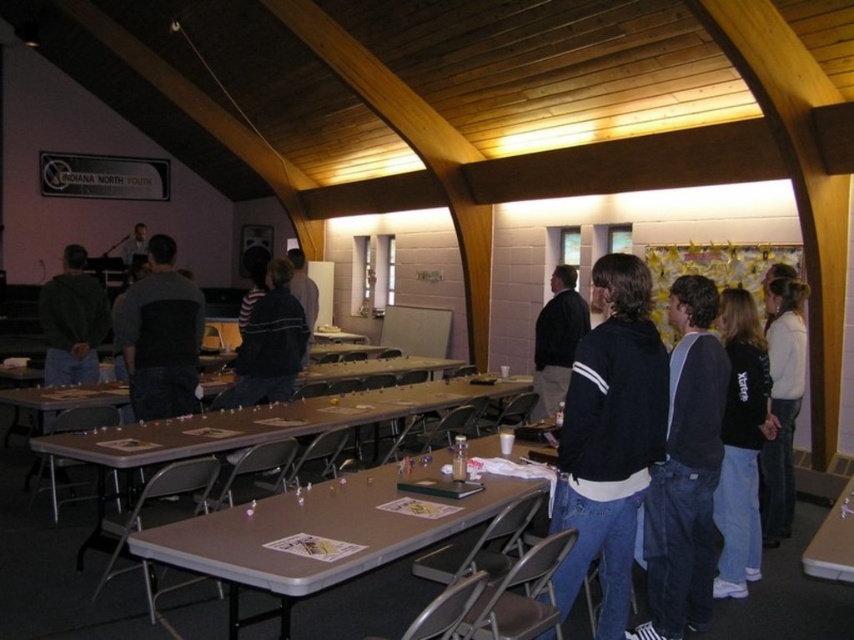
Who is positioned more to the right, black fleece jacket at lower right or smooth white table at lower right?

From the viewer's perspective, black fleece jacket at lower right appears more on the right side.

Does black fleece jacket at lower right have a lesser height compared to smooth white table at lower right?

In fact, black fleece jacket at lower right may be taller than smooth white table at lower right.

Describe the element at coordinates (741, 444) in the screenshot. I see `black fleece jacket at lower right` at that location.

You are a GUI agent. You are given a task and a screenshot of the screen. Output one action in this format:
    pyautogui.click(x=<x>, y=<y>)
    Task: Click on the black fleece jacket at lower right
    This screenshot has height=640, width=854.
    Given the screenshot: What is the action you would take?
    pyautogui.click(x=741, y=444)

Is black sweater at center taller than dark gray hoodie at left?

Incorrect, black sweater at center's height is not larger of dark gray hoodie at left's.

Where is `black sweater at center`? black sweater at center is located at coordinates (270, 342).

Does point (278, 291) lie behind point (48, 292)?

No.

What are the coordinates of `black sweater at center` in the screenshot? It's located at (270, 342).

Who is taller, black fleece jacket at center or white sweater at right?

With more height is white sweater at right.

Can you confirm if black fleece jacket at center is positioned to the left of white sweater at right?

Indeed, black fleece jacket at center is positioned on the left side of white sweater at right.

Does point (578, 468) come in front of point (773, 378)?

Yes, it is.

You are a GUI agent. You are given a task and a screenshot of the screen. Output one action in this format:
    pyautogui.click(x=<x>, y=<y>)
    Task: Click on the black fleece jacket at center
    Image resolution: width=854 pixels, height=640 pixels.
    Given the screenshot: What is the action you would take?
    (x=609, y=438)